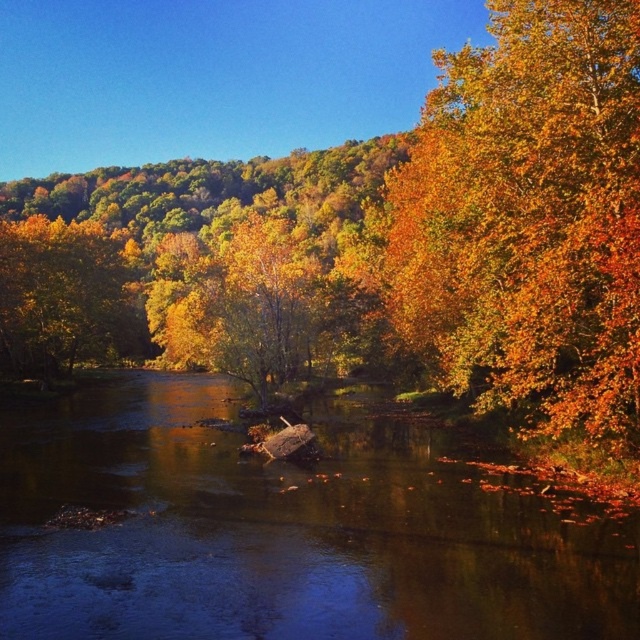
Question: Can you confirm if golden leafy tree at right is positioned to the left of golden leafy tree at left?

Choices:
 (A) no
 (B) yes

Answer: (A)

Question: Which point appears closest to the camera in this image?

Choices:
 (A) (360, 538)
 (B) (598, 1)

Answer: (A)

Question: Which point is farther to the camera?

Choices:
 (A) (621, 269)
 (B) (336, 621)

Answer: (A)

Question: Which is farther from the golden leafy tree at right?

Choices:
 (A) golden leafy tree at left
 (B) shiny brown water at center

Answer: (A)

Question: Does shiny brown water at center appear under golden leafy tree at left?

Choices:
 (A) yes
 (B) no

Answer: (A)

Question: From the image, what is the correct spatial relationship of shiny brown water at center in relation to golden leafy tree at right?

Choices:
 (A) left
 (B) right

Answer: (A)